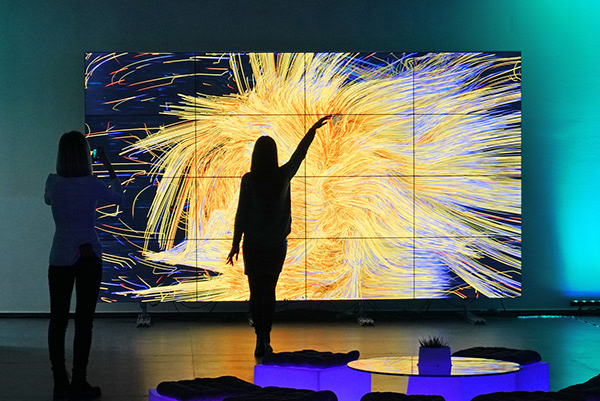
Find the location of a particular element. Image resolution: width=600 pixels, height=401 pixels. wall is located at coordinates (549, 77).